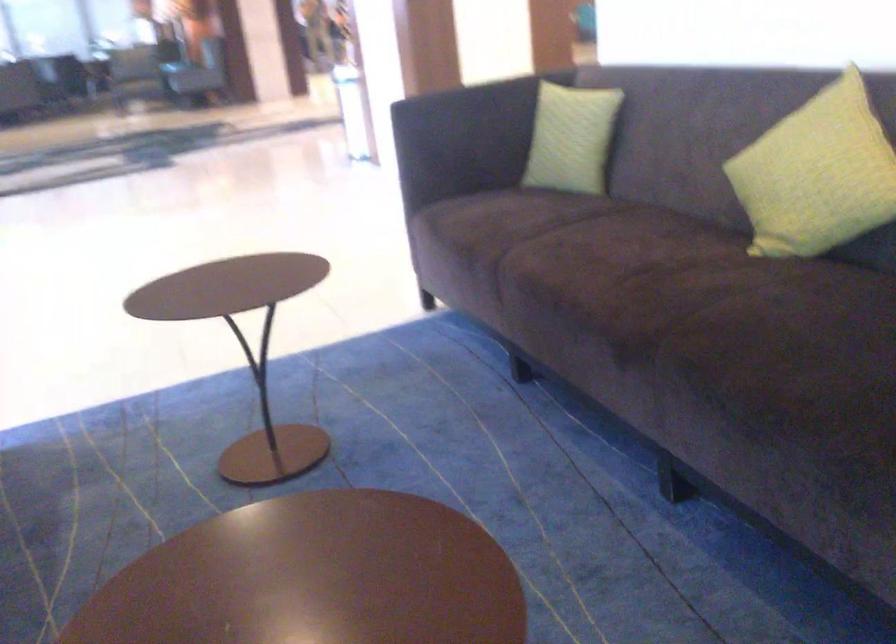
Find where to sit the sofa sitting surface. Please return your answer as a coordinate pair (x, y).

(509, 221)